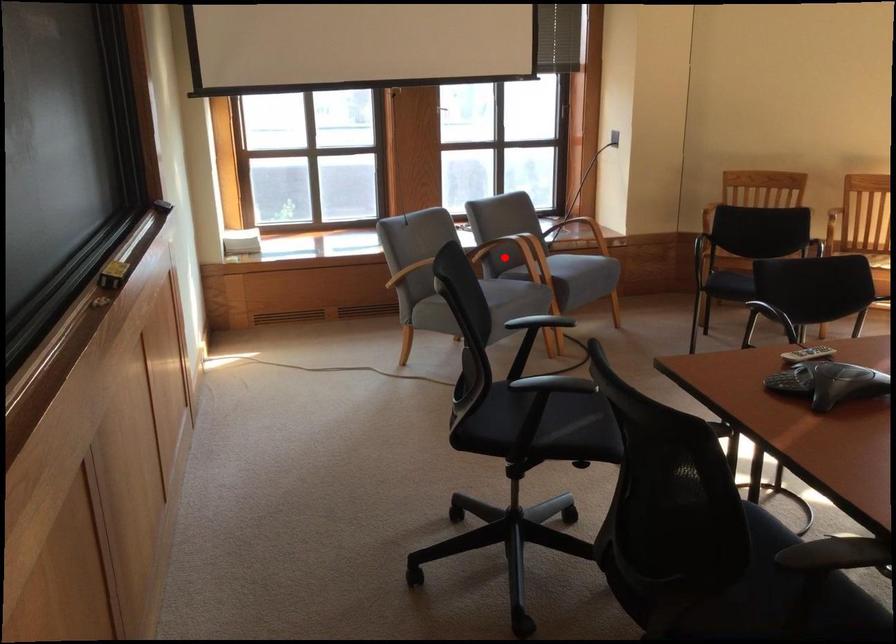
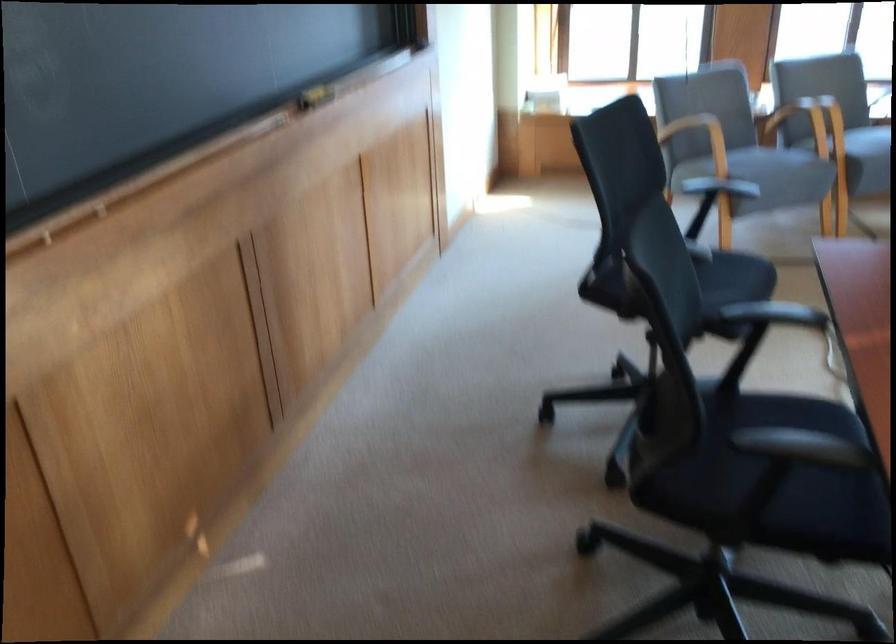
Locate, in the second image, the point that corresponds to the highlighted location in the first image.

(799, 122)